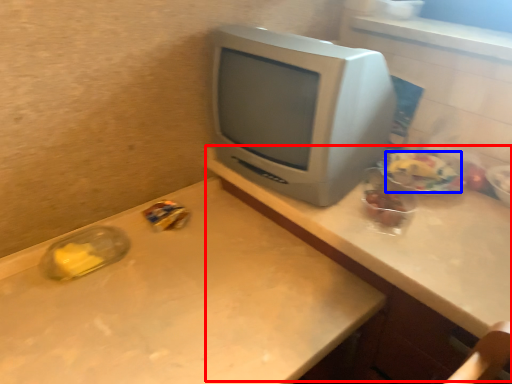
Question: Which object is further to the camera taking this photo, computer desk (highlighted by a red box) or food (highlighted by a blue box)?

Choices:
 (A) computer desk
 (B) food

Answer: (B)